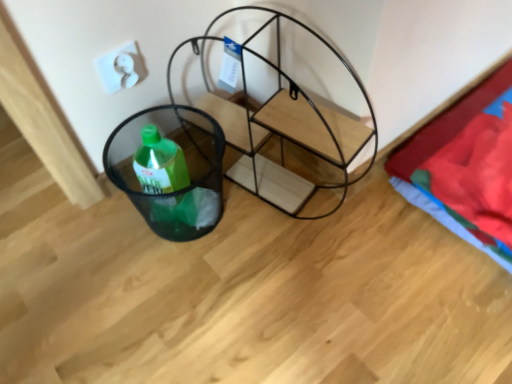
Question: Should I look upward or downward to see black mesh basket at lower left?

Choices:
 (A) up
 (B) down

Answer: (A)

Question: Could you tell me if black wire shelving unit at center is turned towards black mesh basket at lower left?

Choices:
 (A) no
 (B) yes

Answer: (B)

Question: Is black wire shelving unit at center thinner than black mesh basket at lower left?

Choices:
 (A) yes
 (B) no

Answer: (B)

Question: Does black wire shelving unit at center have a lesser height compared to black mesh basket at lower left?

Choices:
 (A) yes
 (B) no

Answer: (B)

Question: From the image's perspective, is black wire shelving unit at center below black mesh basket at lower left?

Choices:
 (A) no
 (B) yes

Answer: (A)

Question: Is black wire shelving unit at center completely or partially outside of black mesh basket at lower left?

Choices:
 (A) no
 (B) yes

Answer: (B)

Question: Considering the relative sizes of black wire shelving unit at center and black mesh basket at lower left in the image provided, is black wire shelving unit at center smaller than black mesh basket at lower left?

Choices:
 (A) yes
 (B) no

Answer: (B)

Question: Is red cotton blanket at right closer to the viewer compared to black mesh basket at lower left?

Choices:
 (A) no
 (B) yes

Answer: (A)

Question: Is red cotton blanket at right thinner than black mesh basket at lower left?

Choices:
 (A) yes
 (B) no

Answer: (B)

Question: From a real-world perspective, is red cotton blanket at right positioned over black mesh basket at lower left based on gravity?

Choices:
 (A) no
 (B) yes

Answer: (A)

Question: Does red cotton blanket at right have a lesser height compared to black mesh basket at lower left?

Choices:
 (A) yes
 (B) no

Answer: (A)

Question: Is red cotton blanket at right aimed at black mesh basket at lower left?

Choices:
 (A) yes
 (B) no

Answer: (A)

Question: Would you consider red cotton blanket at right to be distant from black mesh basket at lower left?

Choices:
 (A) no
 (B) yes

Answer: (A)

Question: Does black mesh basket at lower left turn towards red cotton blanket at right?

Choices:
 (A) no
 (B) yes

Answer: (A)